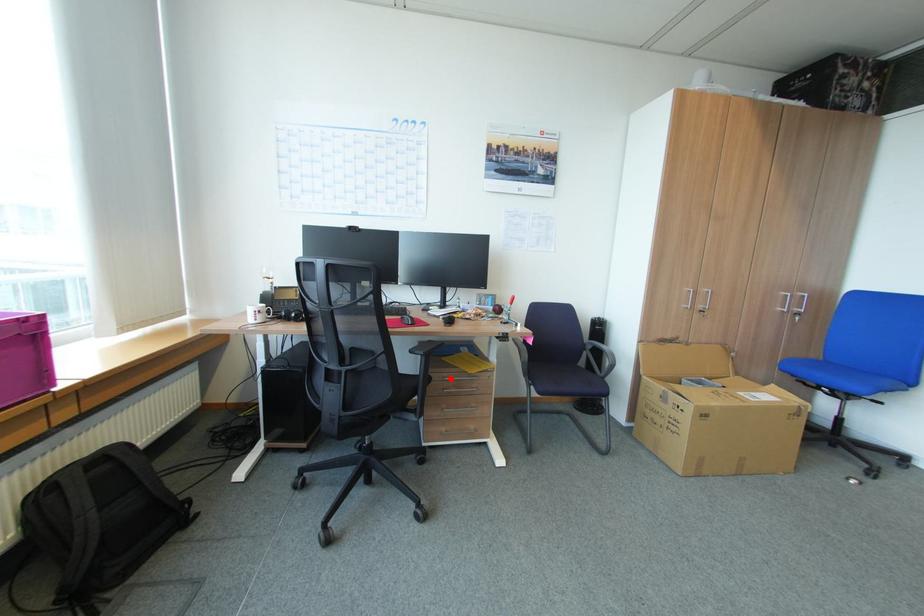
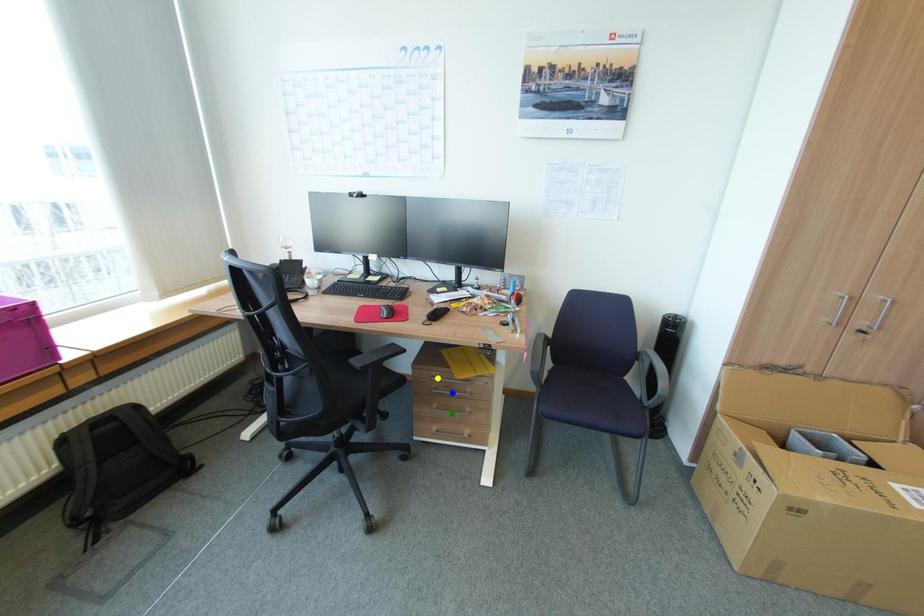
Question: I am providing you with two images of the same scene from different viewpoints. A red point is marked on the first image. You are given multiple points on the second image. In image 2, which mark is for the same physical point as the one in image 1?

Choices:
 (A) yellow point
 (B) green point
 (C) blue point

Answer: (A)